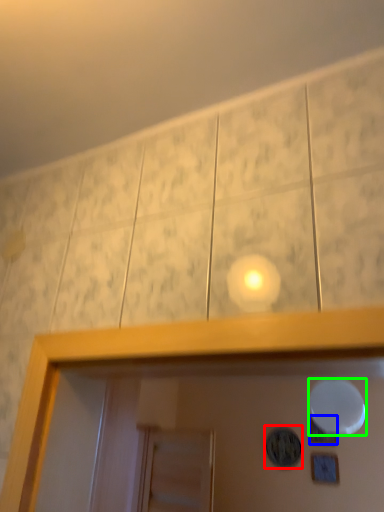
Question: Considering the real-world distances, which object is closest to dot (highlighted by a red box)? dot (highlighted by a blue box) or mirror (highlighted by a green box).

Choices:
 (A) dot
 (B) mirror

Answer: (A)